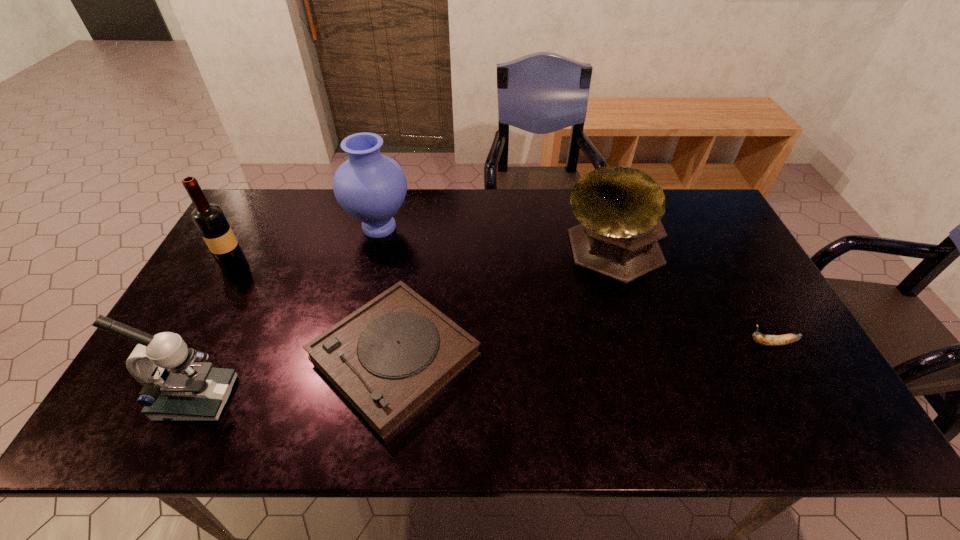
Locate an element on the screen. This screenshot has height=540, width=960. vacant position located at the eyepiece of the microscope is located at coordinates (368, 399).

I want to click on vacant area located at the stem of the rightmost object, so pos(589,343).

This screenshot has width=960, height=540. I want to click on vacant space positioned at the stem of the rightmost object, so click(613, 343).

The image size is (960, 540). I want to click on vacant region located 0.230m at the stem of the rightmost object, so click(656, 343).

What are the coordinates of `vacant space located 0.140m on the right of the shorter phonograph record` in the screenshot? It's located at (537, 356).

The image size is (960, 540). In order to click on phonograph record present at the far edge in this screenshot , I will do `click(620, 208)`.

The width and height of the screenshot is (960, 540). What are the coordinates of `vase that is at the far edge` in the screenshot? It's located at (371, 187).

Locate an element on the screen. This screenshot has width=960, height=540. microscope that is at the near edge is located at coordinates (175, 388).

Image resolution: width=960 pixels, height=540 pixels. Find the location of `phonograph record located in the near edge section of the desktop`. phonograph record located in the near edge section of the desktop is located at coordinates (388, 358).

Identify the location of wine bottle at the left edge. The width and height of the screenshot is (960, 540). (209, 218).